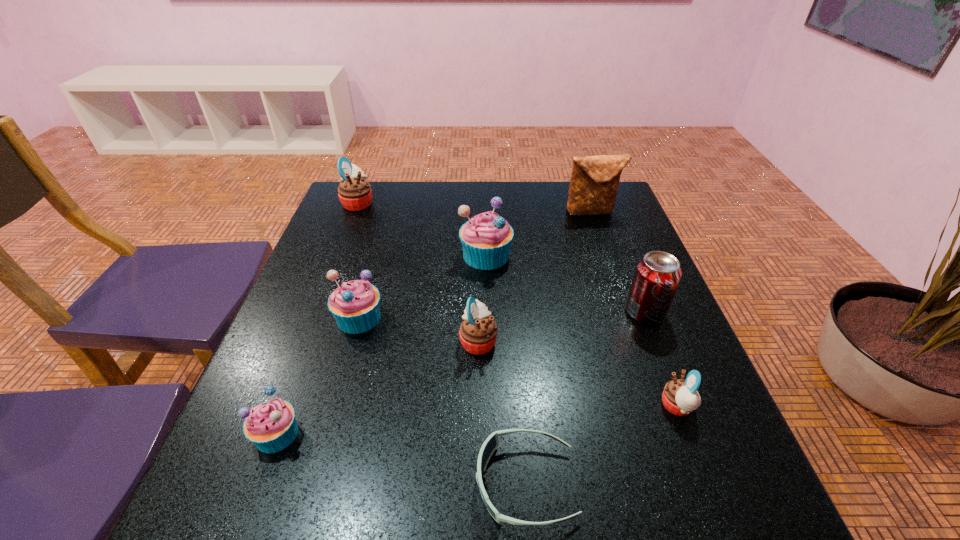
What are the coordinates of `the smallest pink muffin` in the screenshot? It's located at (680, 397).

This screenshot has width=960, height=540. I want to click on the nearest pink muffin, so click(x=680, y=397).

Find the location of a particular element. This screenshot has height=540, width=960. the shortest object is located at coordinates (491, 443).

Where is `blank space located on the open side of the clutch bag`? This screenshot has width=960, height=540. blank space located on the open side of the clutch bag is located at coordinates (610, 263).

The height and width of the screenshot is (540, 960). Identify the location of free spot located on the front-facing side of the farthest pink muffin. (477, 203).

At what (x,y) coordinates should I click in order to perform the action: click on free space located 0.380m on the left of the rightmost blue muffin. Please return your answer as a coordinate pair (x, y). The height and width of the screenshot is (540, 960). Looking at the image, I should click on (313, 255).

Where is `free space located 0.310m on the left of the soda can`? free space located 0.310m on the left of the soda can is located at coordinates (487, 312).

This screenshot has height=540, width=960. Identify the location of vacant space situated 0.170m on the front-facing side of the second farthest pink muffin. (578, 341).

The image size is (960, 540). Identify the location of vacant position located on the right of the second smallest blue muffin. (565, 318).

At what (x,y) coordinates should I click in order to perform the action: click on vacant area situated 0.260m on the right of the nearest blue muffin. Please return your answer as a coordinate pair (x, y). This screenshot has height=540, width=960. Looking at the image, I should click on (450, 434).